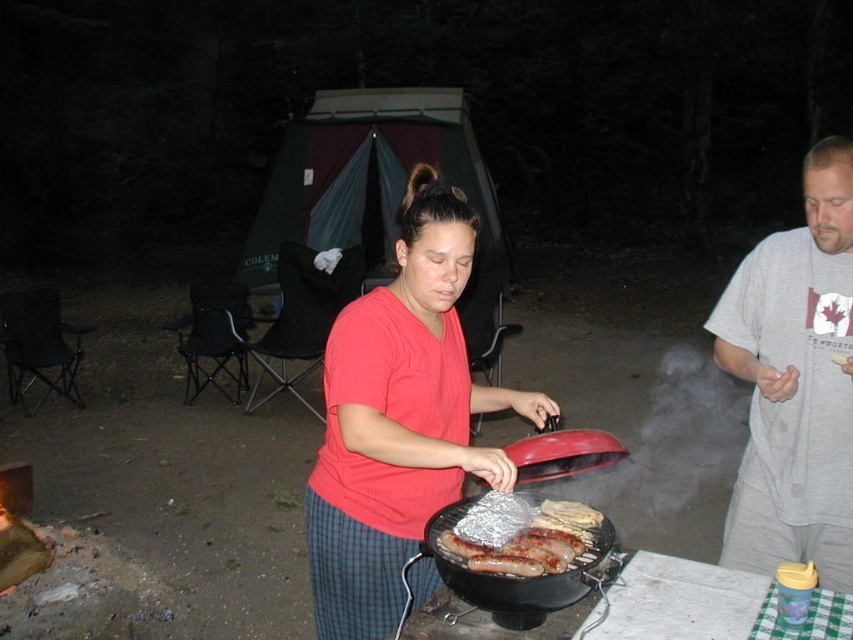
Question: Which point appears closest to the camera in this image?

Choices:
 (A) (845, 164)
 (B) (457, 205)
 (C) (845, 572)
 (D) (514, 525)

Answer: (D)

Question: Is the position of matte red grill at center more distant than that of grilled sausage at center?

Choices:
 (A) yes
 (B) no

Answer: (A)

Question: Which object is closer to the camera taking this photo?

Choices:
 (A) red matte shirt at center
 (B) gray cotton t-shirt at right

Answer: (A)

Question: Which of the following is the farthest from the observer?

Choices:
 (A) red matte shirt at center
 (B) gray cotton t-shirt at right
 (C) grilled sausage at center
 (D) matte red grill at center

Answer: (D)

Question: Considering the relative positions of gray cotton t-shirt at right and grilled sausage at center in the image provided, where is gray cotton t-shirt at right located with respect to grilled sausage at center?

Choices:
 (A) left
 (B) right

Answer: (B)

Question: Can you confirm if gray cotton t-shirt at right is smaller than grilled sausage at center?

Choices:
 (A) yes
 (B) no

Answer: (B)